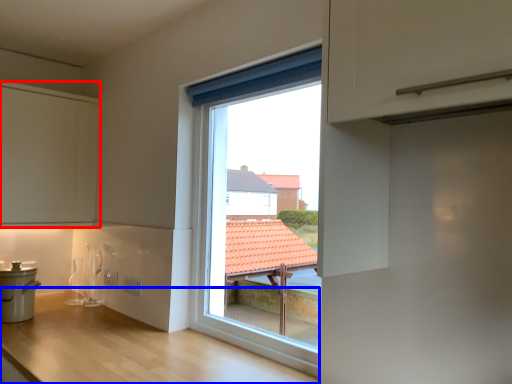
Question: Among these objects, which one is nearest to the camera, cabinetry (highlighted by a red box) or counter (highlighted by a blue box)?

Choices:
 (A) cabinetry
 (B) counter

Answer: (B)